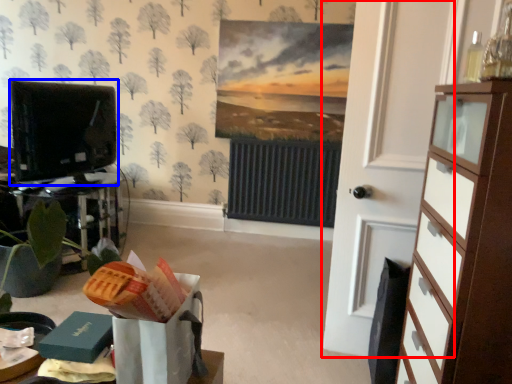
Question: Which object is closer to the camera taking this photo, door (highlighted by a red box) or electronic (highlighted by a blue box)?

Choices:
 (A) door
 (B) electronic

Answer: (A)